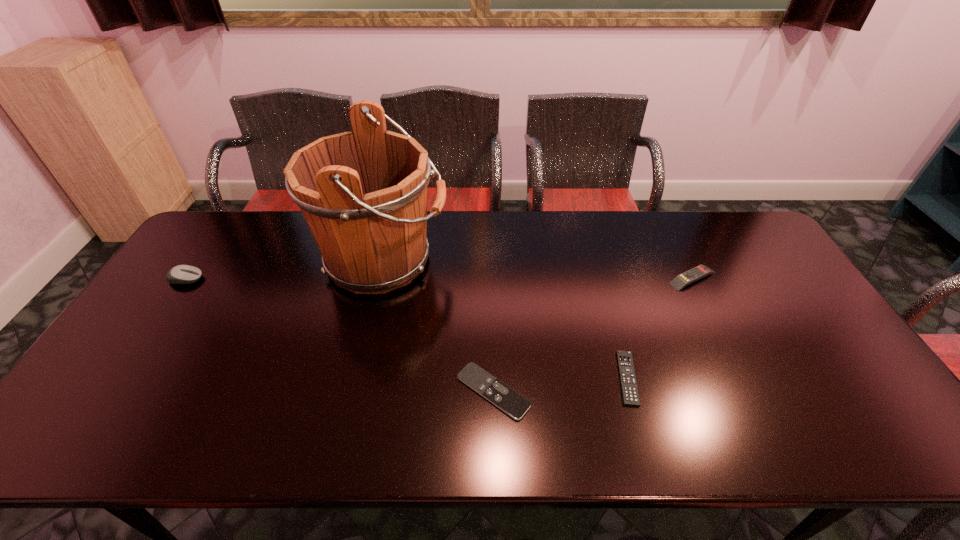
I want to click on vacant space in between the third object from left to right and the rightmost object, so click(593, 335).

Find the location of a particular element. Image resolution: width=960 pixels, height=540 pixels. free space between the bucket and the second remote control from right to left is located at coordinates (506, 319).

Locate an element on the screen. The image size is (960, 540). free space that is in between the third shortest object and the third object from right to left is located at coordinates (593, 335).

The width and height of the screenshot is (960, 540). In order to click on vacant area that lies between the leftmost remote control and the third tallest object in this screenshot , I will do `click(593, 335)`.

I want to click on free area in between the second remote control from left to right and the leftmost remote control, so click(x=561, y=384).

Where is `empty space that is in between the fourth object from left to right and the leftmost object`? The height and width of the screenshot is (540, 960). empty space that is in between the fourth object from left to right and the leftmost object is located at coordinates (407, 328).

You are a GUI agent. You are given a task and a screenshot of the screen. Output one action in this format:
    pyautogui.click(x=<x>, y=<y>)
    Task: Click on the blank region between the third object from left to right and the bucket
    
    Given the screenshot: What is the action you would take?
    pos(439,326)

Identify the location of empty space that is in between the second object from right to left and the rightmost remote control. The width and height of the screenshot is (960, 540). (660, 328).

Locate an element on the screen. free space between the second object from right to left and the leftmost object is located at coordinates (407, 328).

This screenshot has height=540, width=960. In order to click on empty space that is in between the rightmost object and the leftmost object in this screenshot , I will do `click(439, 279)`.